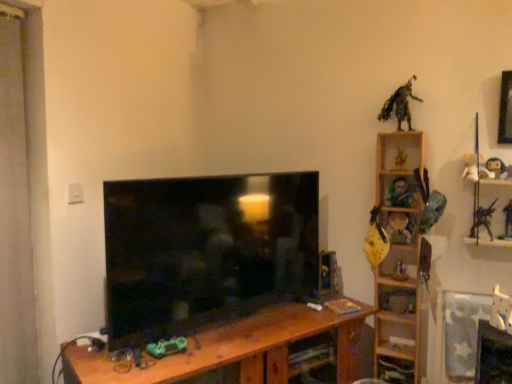
Question: From the image's perspective, is metallic silver toy at upper right, arranged as the 9th toy when viewed from the left, above or below green metallic figure at upper right, which appears as the third toy when viewed from the left?

Choices:
 (A) below
 (B) above

Answer: (A)

Question: Is metallic silver toy at upper right, positioned as the 4th toy in right-to-left order, wider or thinner than green metallic figure at upper right, marked as the 10th toy in a right-to-left arrangement?

Choices:
 (A) wide
 (B) thin

Answer: (B)

Question: Which of these objects is positioned closest to the metallic silver toy at right, the twelfth toy positioned from the left?

Choices:
 (A) yellow matte guitar at upper right, the 4th toy from the left
 (B) matte black action figure at upper right, which is the eleventh toy in left-to-right order
 (C) yellow matte guitar at right, positioned as the 2th toy in left-to-right order
 (D) wooden guitar at upper right, which ranks as the 7th toy in left-to-right order
 (E) plush white doll at upper right, placed as the tenth toy when sorted from left to right

Answer: (E)

Question: Which of these objects is positioned farthest from the metallic silver toy at upper right, positioned as the 4th toy in right-to-left order?

Choices:
 (A) plush white doll at upper right, placed as the tenth toy when sorted from left to right
 (B) metallic silver toy at right, the twelfth toy positioned from the left
 (C) matte black tv at center
 (D) yellow matte plush toy at right, the sixth toy in the left-to-right sequence
 (E) yellow matte guitar at upper right, the ninth toy from the right

Answer: (C)